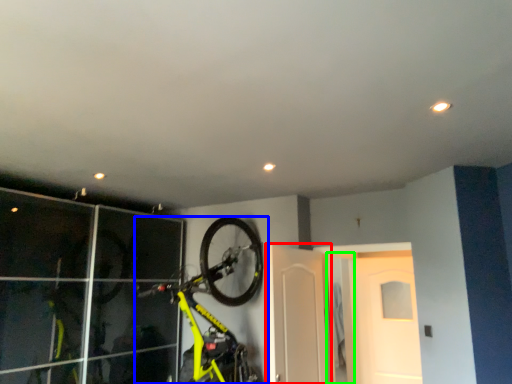
Question: Considering the real-world distances, which object is farthest from door (highlighted by a red box)? bicycle (highlighted by a blue box) or door (highlighted by a green box)?

Choices:
 (A) bicycle
 (B) door

Answer: (B)